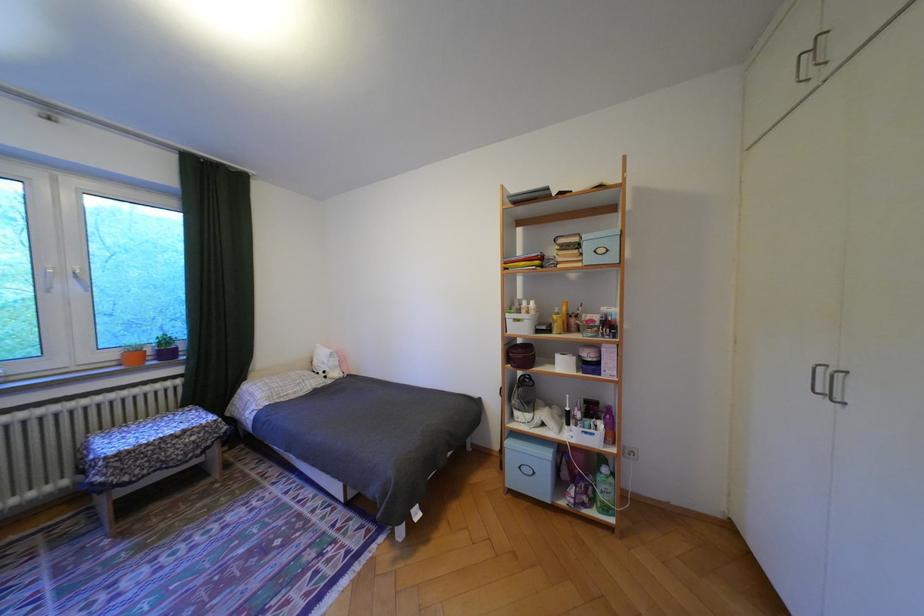
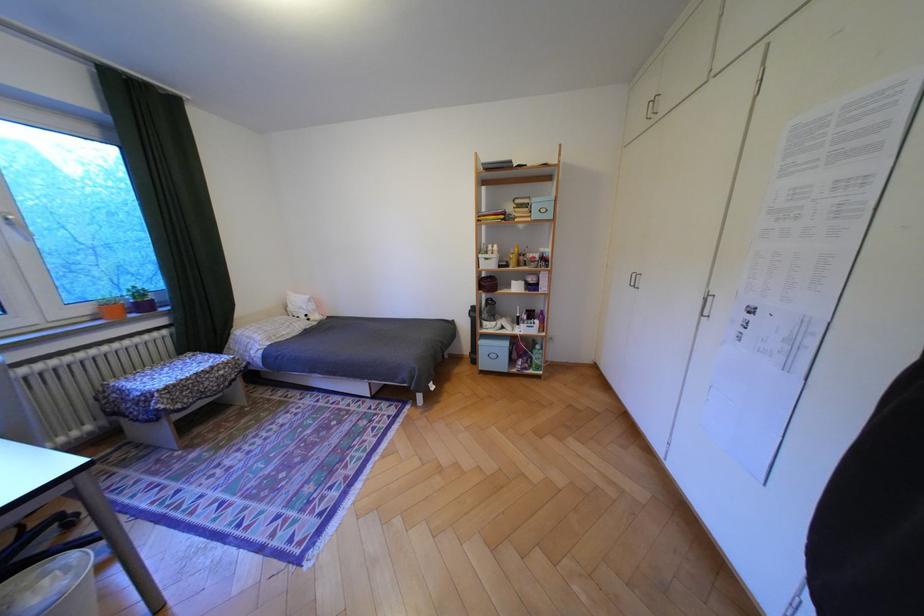
Where in the second image is the point corresponding to [178,354] from the first image?

(155, 307)